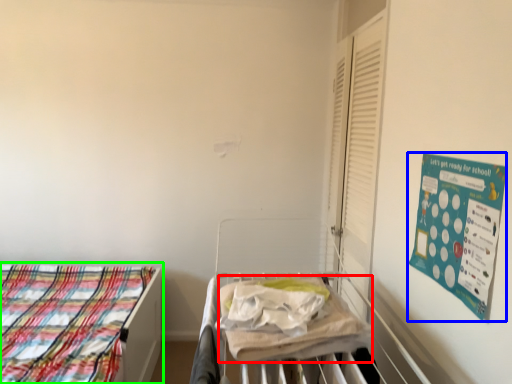
Question: Estimate the real-world distances between objects in this image. Which object is closer to blanket (highlighted by a red box), poster (highlighted by a blue box) or bed (highlighted by a green box)?

Choices:
 (A) poster
 (B) bed

Answer: (A)